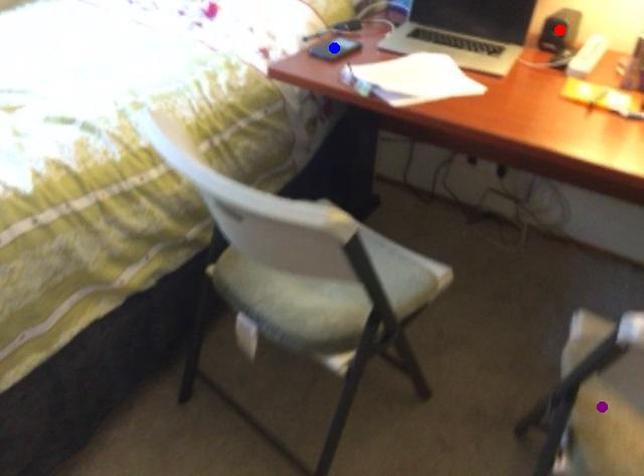
Order these from nearest to farthest:
A) blue point
B) red point
C) purple point

purple point < blue point < red point